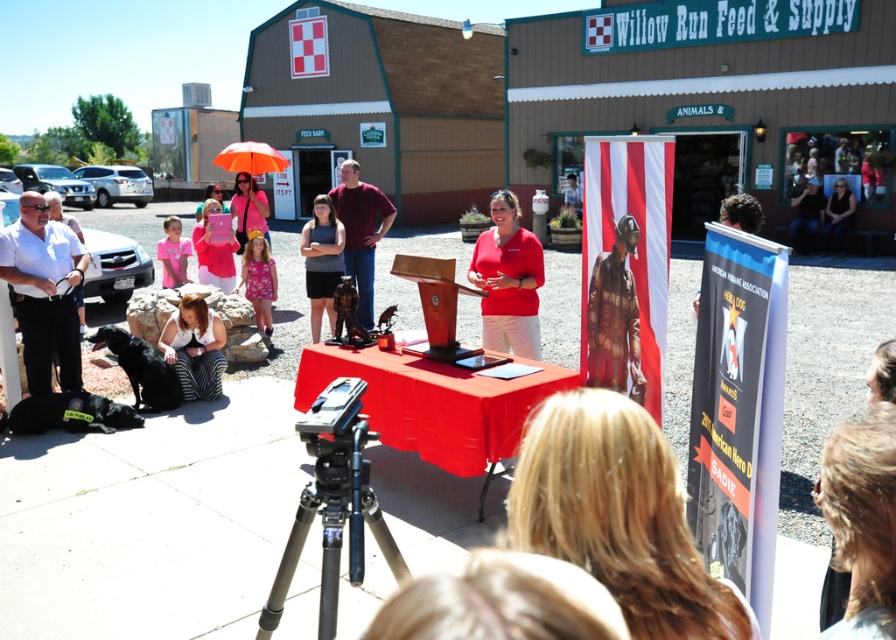
You are a photographer at the event and want to take a photo that includes both the gray fabric shirt at center and the orange matte umbrella at upper center. Which object should you focus on first to ensure both are in sharp focus?

You should focus on the gray fabric shirt at center first because it is closer to the viewer than the orange matte umbrella at upper center, ensuring both will be in focus when focusing on the closer object.